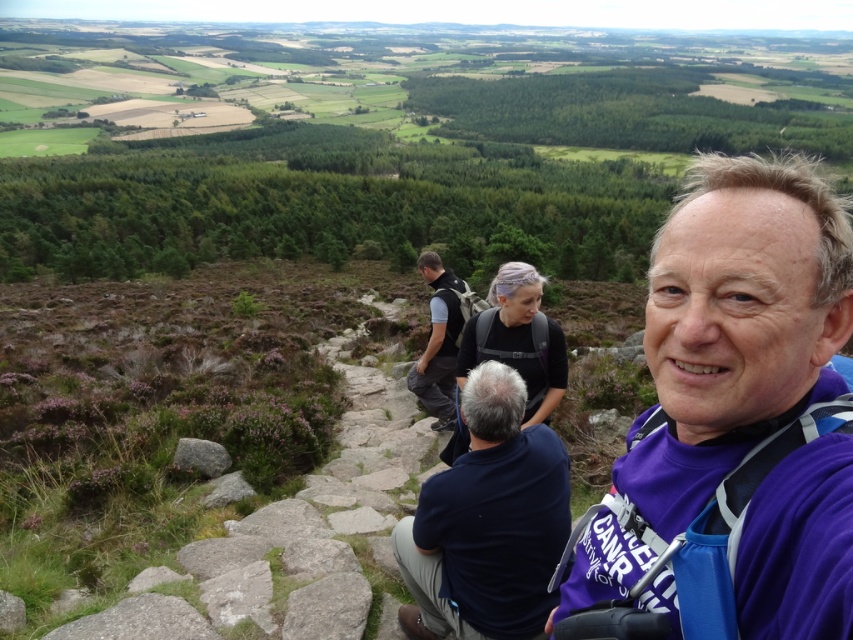
You are a photographer positioned at the edge of the scene. You want to capture a photo that includes both the dark blue shirt at center and the dark gray fabric backpack at center. Based on their sizes, which object should you focus on to ensure both fit in the frame?

The dark blue shirt at center might be wider than dark gray fabric backpack at center, so focusing on the dark blue shirt at center would ensure both objects fit in the frame since it is wider.

You are a photographer standing at the edge of the path. You want to capture a photo of the purple fabric at center and the gray rough rock at lower left in the same frame. Based on their positions, which object should you adjust your camera to focus on first to ensure both are in the shot?

The purple fabric at center is positioned on the right side of gray rough rock at lower left. Since the gray rough rock at lower left is to the left of the purple fabric at center, you should focus on the gray rough rock at lower left first to ensure both are included in the frame.

You are a photographer positioned at the center of the scene. You want to take a photo that includes both the purple fabric at center and the dark gray fabric backpack at center. Which object should you pan your camera to the left to include first?

The dark gray fabric backpack at center should be panned to the left first because the purple fabric at center is to the right of the dark gray fabric backpack at center.